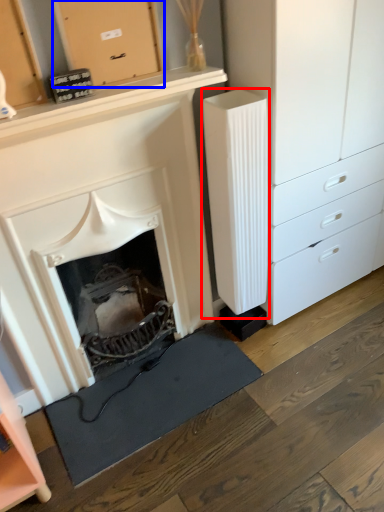
Question: Which of the following is the farthest to the observer, appliance (highlighted by a red box) or cabinetry (highlighted by a blue box)?

Choices:
 (A) appliance
 (B) cabinetry

Answer: (A)